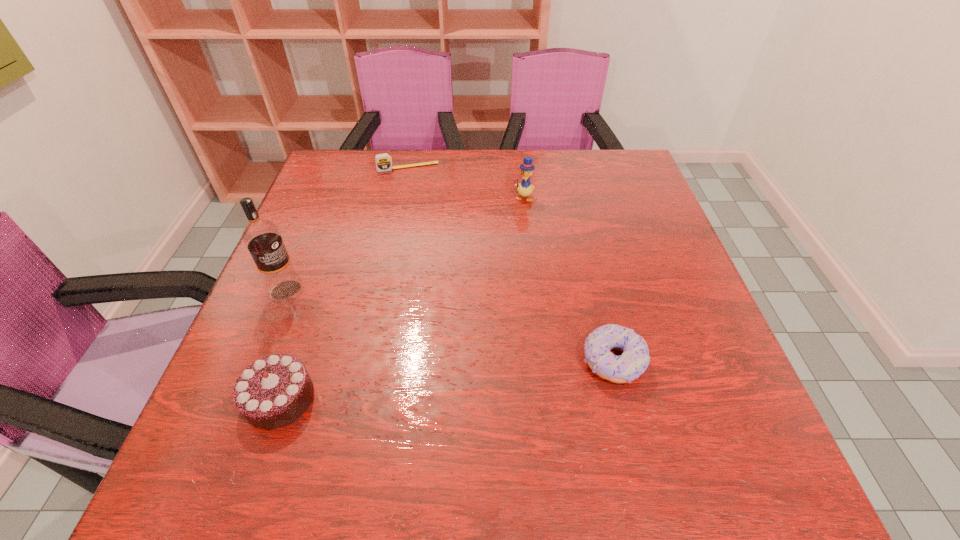
Locate an element on the screen. This screenshot has width=960, height=540. vacant area between the third shortest object and the rightmost object is located at coordinates (446, 380).

Find the location of a particular element. The image size is (960, 540). vacant space that's between the third nearest object and the fourth object from left to right is located at coordinates (405, 244).

Where is `vacant space that's between the tallest object and the chocolate cake`? The height and width of the screenshot is (540, 960). vacant space that's between the tallest object and the chocolate cake is located at coordinates (283, 345).

This screenshot has height=540, width=960. I want to click on object that can be found as the fourth closest to the chocolate cake, so pos(383,161).

At what (x,y) coordinates should I click in order to perform the action: click on the closest object to the tallest object. Please return your answer as a coordinate pair (x, y). This screenshot has height=540, width=960. Looking at the image, I should click on (274, 391).

Locate an element on the screen. The width and height of the screenshot is (960, 540). blank area in the image that satisfies the following two spatial constraints: 1. on the back side of the tallest object; 2. on the right side of the duckling is located at coordinates (324, 198).

This screenshot has height=540, width=960. In order to click on free point that satisfies the following two spatial constraints: 1. on the back side of the vodka; 2. on the left side of the second tallest object in this screenshot , I will do `click(324, 198)`.

You are a GUI agent. You are given a task and a screenshot of the screen. Output one action in this format:
    pyautogui.click(x=<x>, y=<y>)
    Task: Click on the vacant space that satisfies the following two spatial constraints: 1. on the back side of the fourth shortest object; 2. on the right side of the chocolate cake
    Image resolution: width=960 pixels, height=540 pixels.
    Given the screenshot: What is the action you would take?
    pyautogui.click(x=349, y=198)